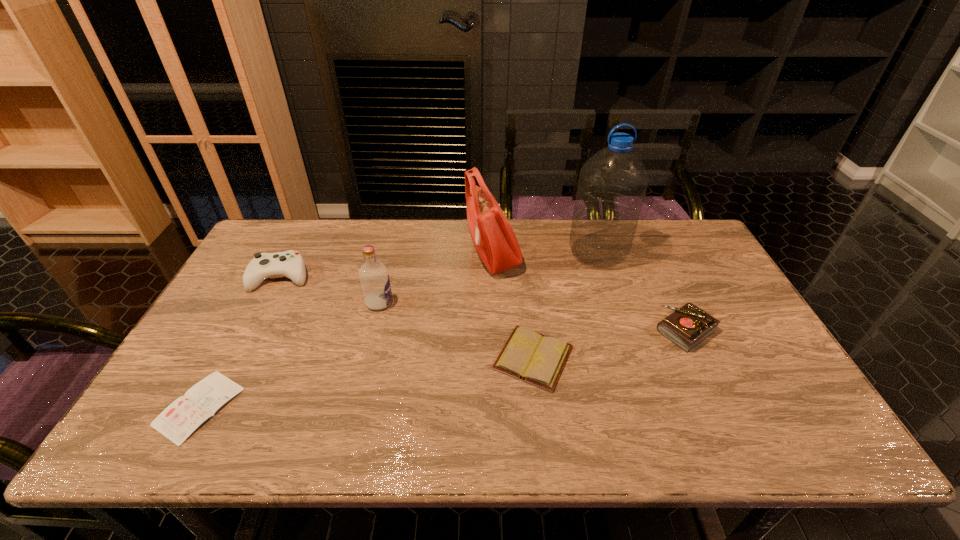
At what (x,y) coordinates should I click in order to perform the action: click on vacant space in between the leftmost diary and the vodka. Please return your answer as a coordinate pair (x, y). Looking at the image, I should click on (289, 354).

At what (x,y) coordinates should I click in order to perform the action: click on free space that is in between the rightmost diary and the shortest diary. Please return your answer as a coordinate pair (x, y). The width and height of the screenshot is (960, 540). Looking at the image, I should click on (443, 368).

This screenshot has width=960, height=540. In order to click on free area in between the third tallest object and the third shortest object in this screenshot , I will do `click(533, 316)`.

You are a GUI agent. You are given a task and a screenshot of the screen. Output one action in this format:
    pyautogui.click(x=<x>, y=<y>)
    Task: Click on the fourth closest object to the fifth object from right to left
    This screenshot has width=960, height=540.
    Given the screenshot: What is the action you would take?
    pyautogui.click(x=181, y=418)

Locate an element on the screen. the fourth closest object relative to the third tallest object is located at coordinates (181, 418).

Point out which diary is positioned as the third nearest to the sixth shortest object. Please provide its 2D coordinates. Your answer should be formatted as a tuple, i.e. [(x, y)], where the tuple contains the x and y coordinates of a point satisfying the conditions above.

[(181, 418)]

Where is `diary that is the second closest one to the vodka`? The image size is (960, 540). diary that is the second closest one to the vodka is located at coordinates (181, 418).

Identify the location of free region that satisfies the following two spatial constraints: 1. on the front side of the fourth shortest object; 2. on the left side of the tallest diary. (253, 330).

The image size is (960, 540). In order to click on vacant region that satisfies the following two spatial constraints: 1. on the front-facing side of the second tallest object; 2. on the back side of the tallest diary in this screenshot , I will do `click(495, 330)`.

I want to click on free point that satisfies the following two spatial constraints: 1. on the label of the rightmost diary; 2. on the right side of the vodka, so click(372, 330).